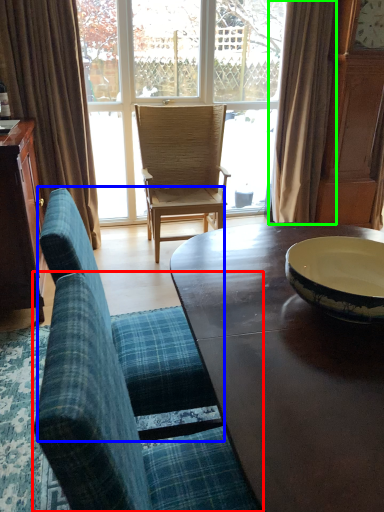
Question: Which object is the closest to the chair (highlighted by a red box)? Choose among these: chair (highlighted by a blue box) or curtain (highlighted by a green box).

Choices:
 (A) chair
 (B) curtain

Answer: (A)